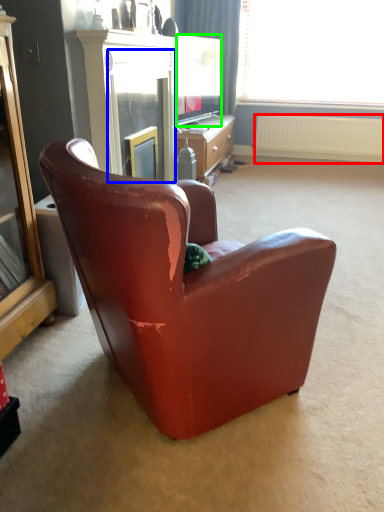
Question: Estimate the real-world distances between objects in this image. Which object is closer to radiator (highlighted by a red box), screen door (highlighted by a blue box) or television (highlighted by a green box)?

Choices:
 (A) screen door
 (B) television

Answer: (B)